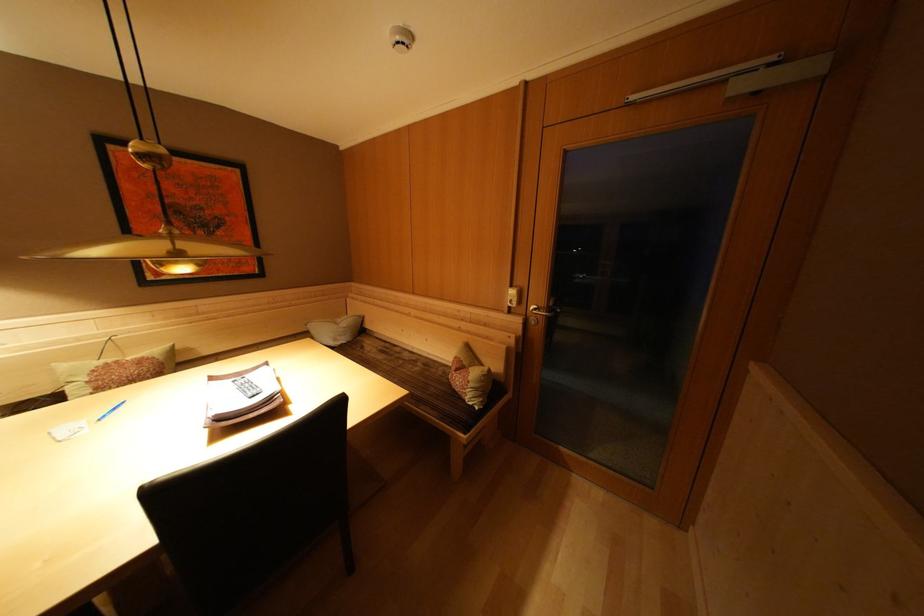
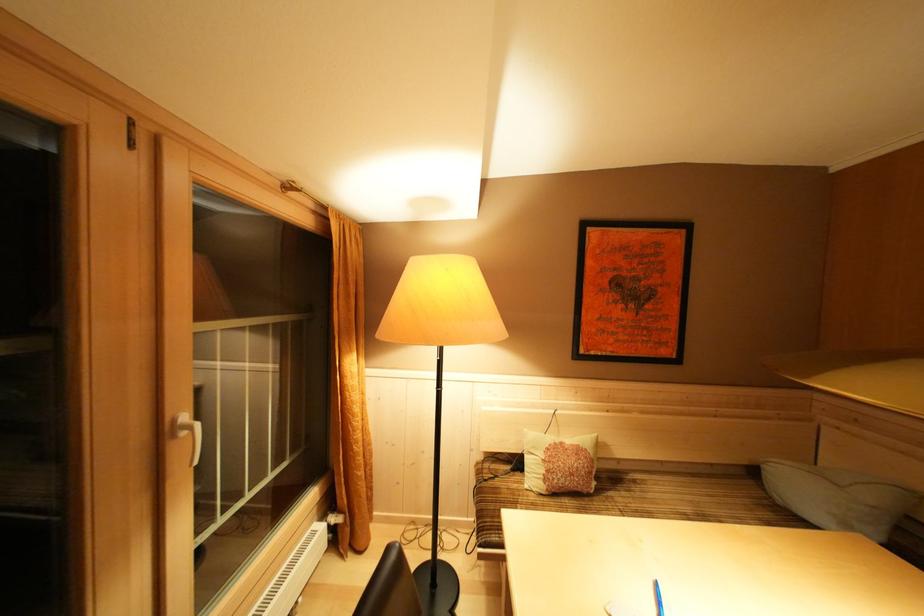
Where in the second image is the point corresponding to pixel 351 329 from the first image?

(879, 503)